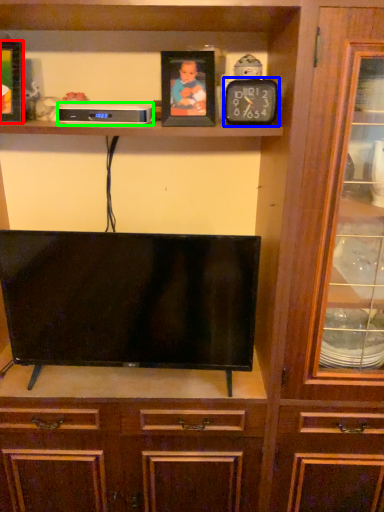
Question: Considering the real-world distances, which object is farthest from picture frame (highlighted by a red box)? clock (highlighted by a blue box) or appliance (highlighted by a green box)?

Choices:
 (A) clock
 (B) appliance

Answer: (A)